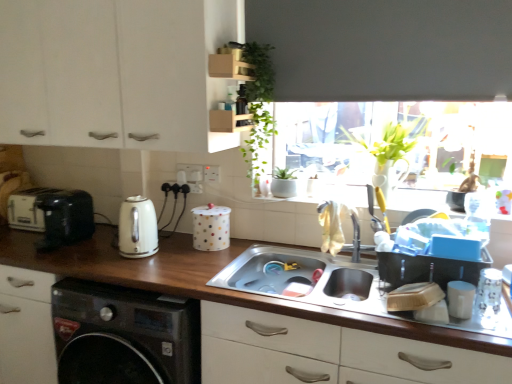
Question: Visually, is green leafy plant at upper center positioned to the left or to the right of matte black bottle at upper center?

Choices:
 (A) left
 (B) right

Answer: (B)

Question: Is green leafy plant at upper center bigger or smaller than matte black bottle at upper center?

Choices:
 (A) big
 (B) small

Answer: (A)

Question: Based on their relative distances, which object is farther from the green leafy plant at upper center?

Choices:
 (A) stainless steel sink at center
 (B) white matte cup at lower right, the 1th appliance positioned from the front
 (C) silver metallic faucet at sink center
 (D) matte black bottle at upper center
 (E) white glossy kettle at left

Answer: (B)

Question: Which object is the closest to the matte black bottle at upper center?

Choices:
 (A) white glossy kettle at left
 (B) matte black toaster at left, positioned as the second appliance in left-to-right order
 (C) white matte cabinet at upper left
 (D) white plastic toaster at left, marked as the 4th appliance in a right-to-left arrangement
 (E) wooden at lower center

Answer: (C)